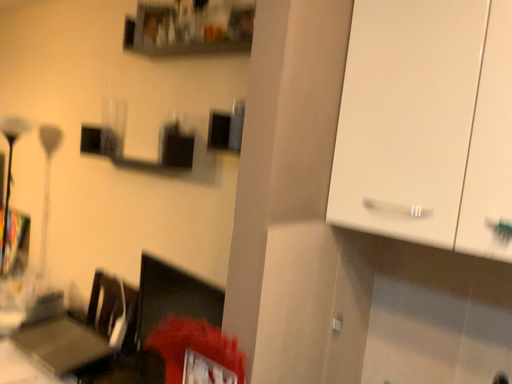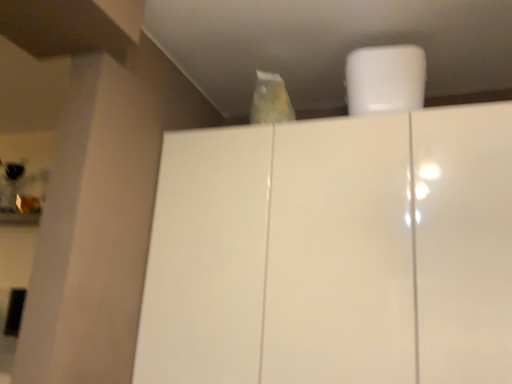
Question: Which way did the camera rotate in the video?

Choices:
 (A) rotated right
 (B) rotated left

Answer: (A)